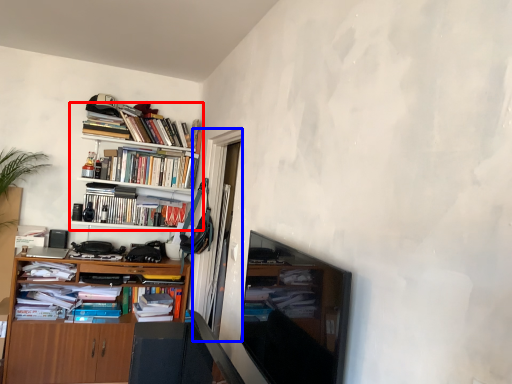
Question: Among these objects, which one is farthest to the camera, bookcase (highlighted by a red box) or glass door (highlighted by a blue box)?

Choices:
 (A) bookcase
 (B) glass door

Answer: (A)